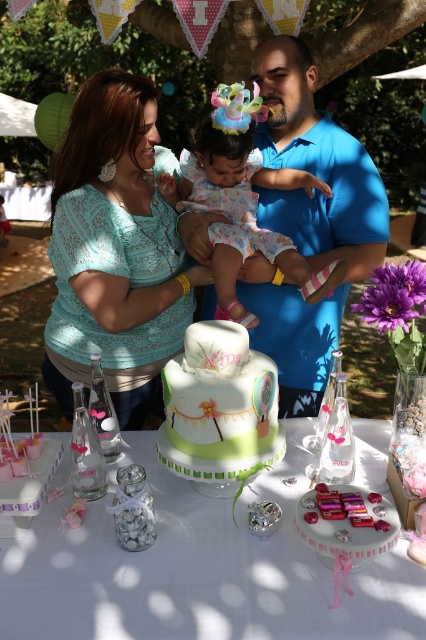
You are a photographer standing at the edge of the table. You need to capture a closeup shot of the pastel green cake at center and the matte teal lace blouse at center in the same frame. Given the camera you have can focus on objects within 24 inches, will you be able to capture both in focus without moving the camera?

The distance between the pastel green cake at center and the matte teal lace blouse at center is 26.24 inches. Since the camera can only focus within 24 inches, the objects are too far apart to be in focus simultaneously. Move the camera closer or adjust the focus.

You are a photographer at the event and need to position yourself so that both the white fondant cake at center and the pastel floral dress at center are in your shot. Which object should you place closer to the left side of your camera frame?

The white fondant cake at center is to the left of the pastel floral dress at center, so you should position the white fondant cake at center closer to the left side of your camera frame to include both in the shot.